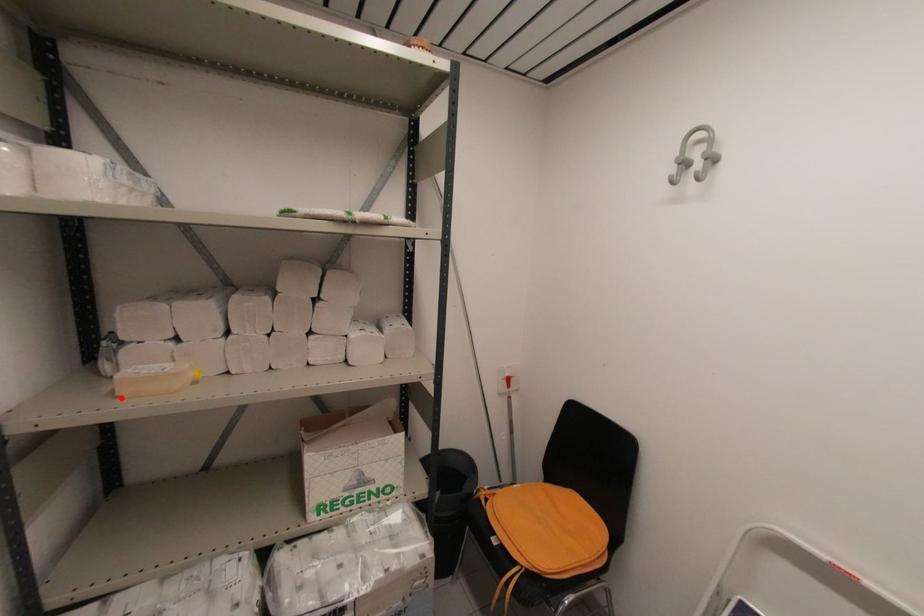
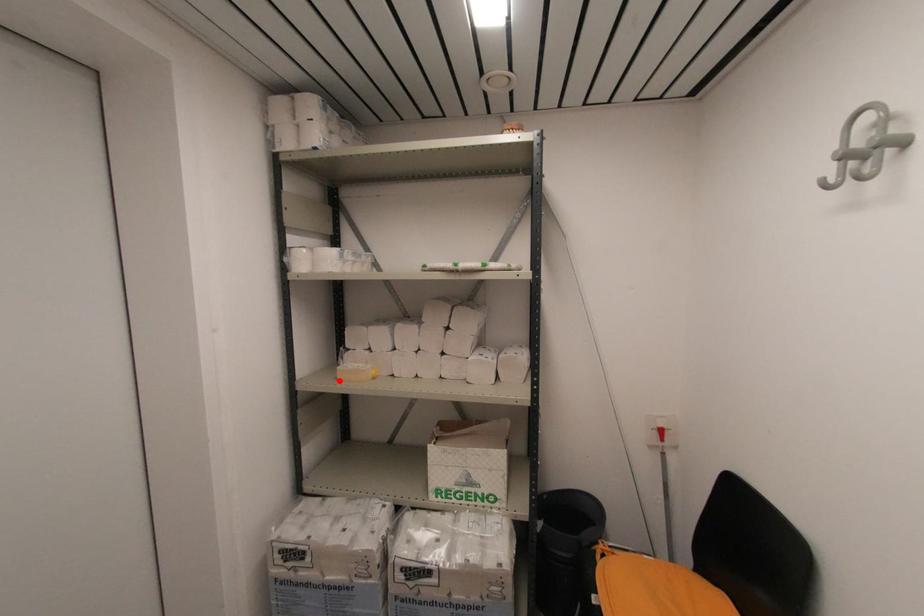
I am providing you with two images of the same scene from different viewpoints. A red point is marked on the first image and another point is marked on the second image. Is the marked point in image1 the same physical position as the marked point in image2?

Yes